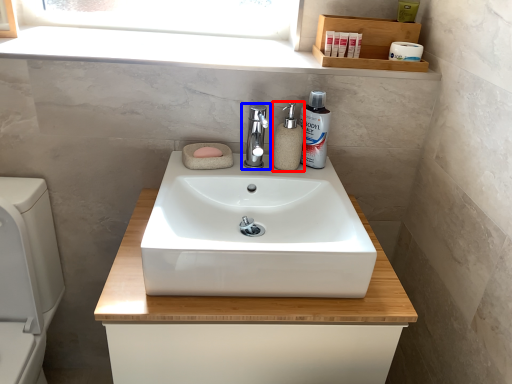
Question: Which point is further to the camera, soap dispenser (highlighted by a red box) or tap (highlighted by a blue box)?

Choices:
 (A) soap dispenser
 (B) tap

Answer: (A)